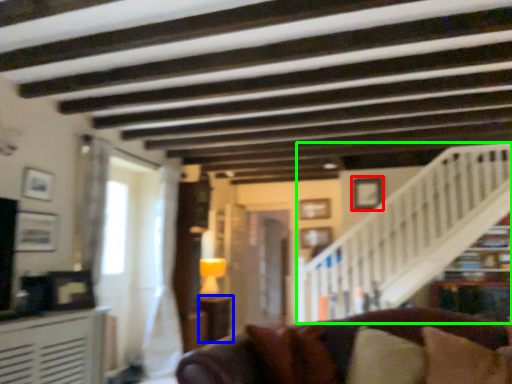
Question: Which object is the closest to the picture frame (highlighted by a red box)? Choose among these: table (highlighted by a blue box) or stairwell (highlighted by a green box).

Choices:
 (A) table
 (B) stairwell

Answer: (B)